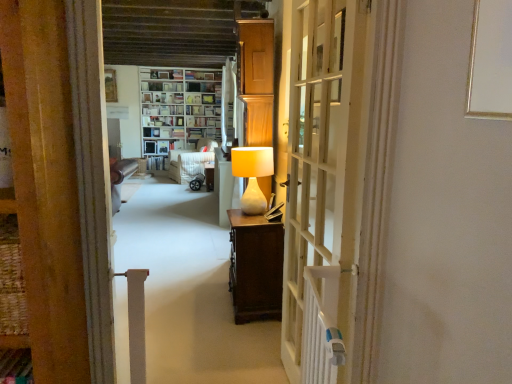
Question: Does white wooden door at center have a smaller size compared to matte white lamp at center?

Choices:
 (A) no
 (B) yes

Answer: (A)

Question: From a real-world perspective, is white wooden door at center positioned over matte white lamp at center based on gravity?

Choices:
 (A) yes
 (B) no

Answer: (A)

Question: Is white wooden door at center shorter than matte white lamp at center?

Choices:
 (A) no
 (B) yes

Answer: (A)

Question: Can you confirm if white wooden door at center is thinner than matte white lamp at center?

Choices:
 (A) yes
 (B) no

Answer: (A)

Question: Is white wooden door at center positioned far away from matte white lamp at center?

Choices:
 (A) no
 (B) yes

Answer: (B)

Question: Would you say white sheer curtain at upper center is inside or outside white fabric armchair at center?

Choices:
 (A) inside
 (B) outside

Answer: (B)

Question: In the image, is white sheer curtain at upper center positioned in front of or behind white fabric armchair at center?

Choices:
 (A) front
 (B) behind

Answer: (A)

Question: Considering the positions of point (224, 129) and point (193, 152), is point (224, 129) closer or farther from the camera than point (193, 152)?

Choices:
 (A) closer
 (B) farther

Answer: (A)

Question: In the image, is white sheer curtain at upper center on the left side or the right side of white fabric armchair at center?

Choices:
 (A) right
 (B) left

Answer: (A)

Question: From their relative heights in the image, would you say white sheer curtain at upper center is taller or shorter than wooden picture frame at upper center?

Choices:
 (A) short
 (B) tall

Answer: (B)

Question: In the image, is white sheer curtain at upper center on the left side or the right side of wooden picture frame at upper center?

Choices:
 (A) right
 (B) left

Answer: (A)

Question: Do you think white sheer curtain at upper center is within wooden picture frame at upper center, or outside of it?

Choices:
 (A) outside
 (B) inside

Answer: (A)

Question: Is point (224, 117) closer or farther from the camera than point (105, 87)?

Choices:
 (A) closer
 (B) farther

Answer: (A)

Question: Is wooden picture frame at upper center spatially inside matte white lamp at center, or outside of it?

Choices:
 (A) inside
 (B) outside

Answer: (B)

Question: From the image's perspective, is wooden picture frame at upper center located above or below matte white lamp at center?

Choices:
 (A) below
 (B) above

Answer: (B)